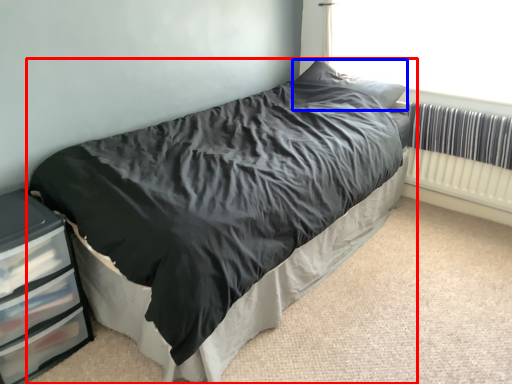
Question: Among these objects, which one is nearest to the camera, bed (highlighted by a red box) or pillow (highlighted by a blue box)?

Choices:
 (A) bed
 (B) pillow

Answer: (A)